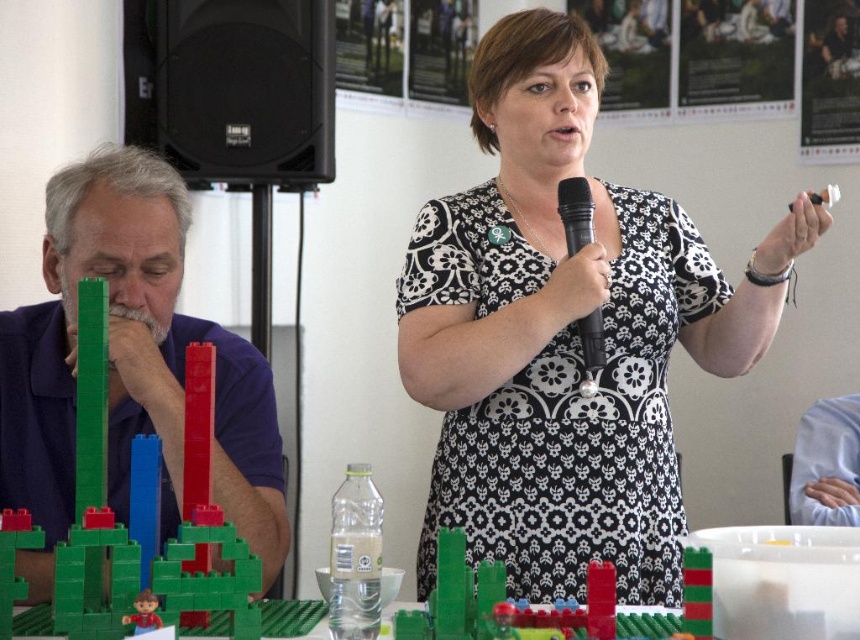
You are sitting in the front row of the presentation. The black matte speaker at upper left is part of the audio system. If you want to adjust its volume, can you reach it from where you are sitting?

The black matte speaker at upper left is 2.57 meters from viewer. Since it is more than 2 meters away, you might need to get up and walk closer to adjust the volume.

You are an attendee at the presentation and want to hand the speaker a note. The speaker is holding a microphone and a small object. Which object should you approach first, the black matte speaker at upper left or the green plastic blocks at center, to reach the speaker?

The black matte speaker at upper left is closer to you than the green plastic blocks at center, so you should approach the black matte speaker at upper left first to reach the speaker.

You are an attendee at the presentation and want to hand the presenter a note. You see the black printed dress at center and the green plastic blocks at center. Which object is closer to you?

The black printed dress at center is closer to you because the green plastic blocks at center are behind it.